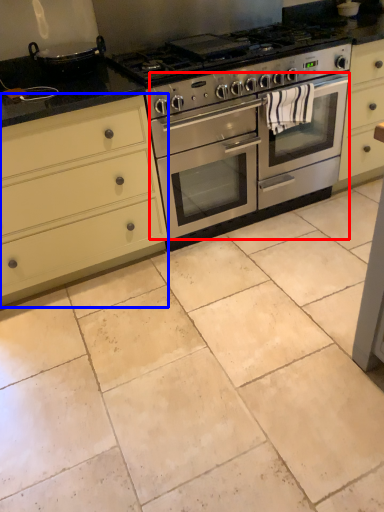
Question: Which object appears closest to the camera in this image, oven (highlighted by a red box) or cabinetry (highlighted by a blue box)?

Choices:
 (A) oven
 (B) cabinetry

Answer: (B)